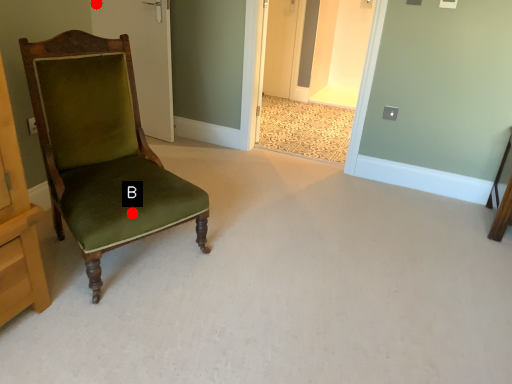
Question: Two points are circled on the image, labeled by A and B beside each circle. Which of the following is the farthest from the observer?

Choices:
 (A) A is further
 (B) B is further

Answer: (A)